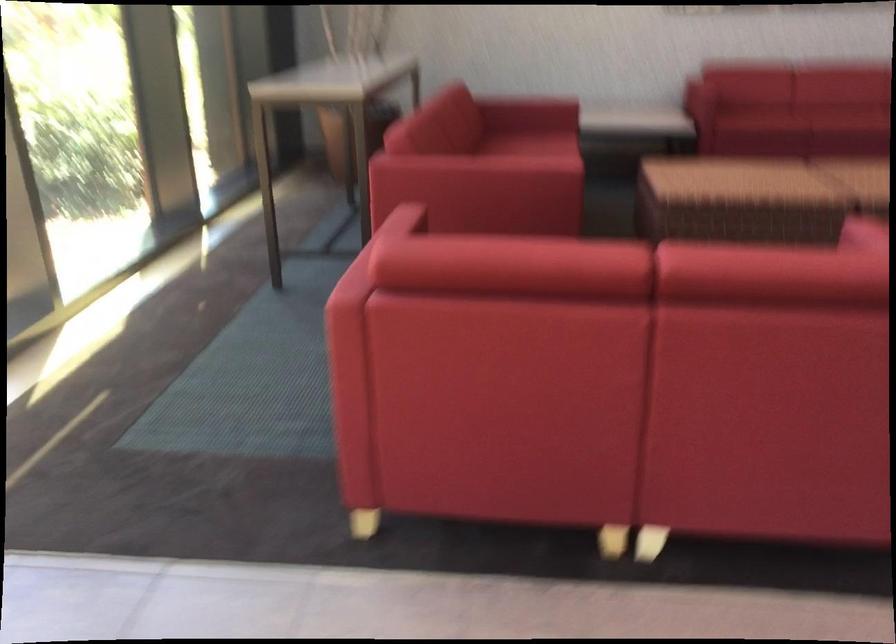
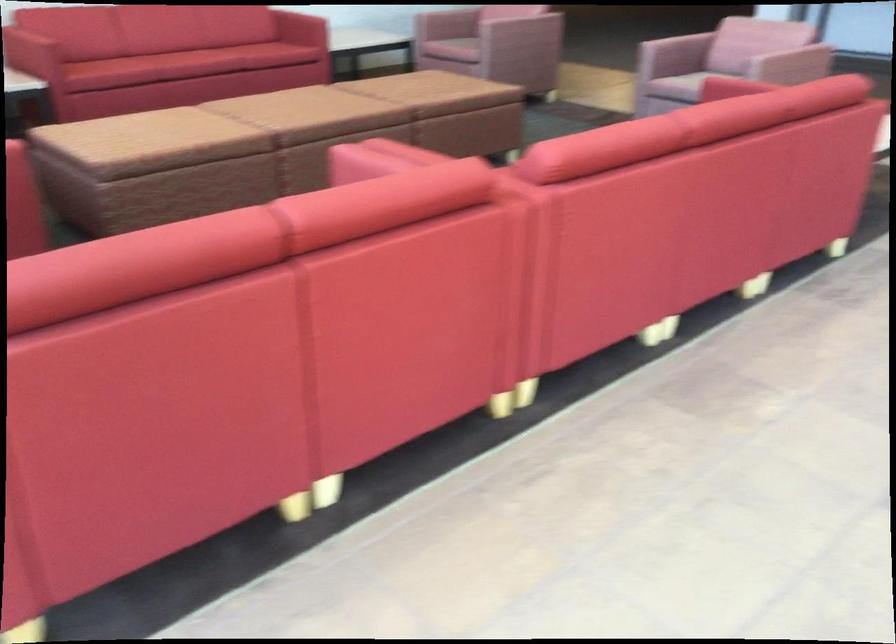
Consider the image. Based on the continuous images, in which direction is the camera rotating?

The rotation direction of the camera is right-down.